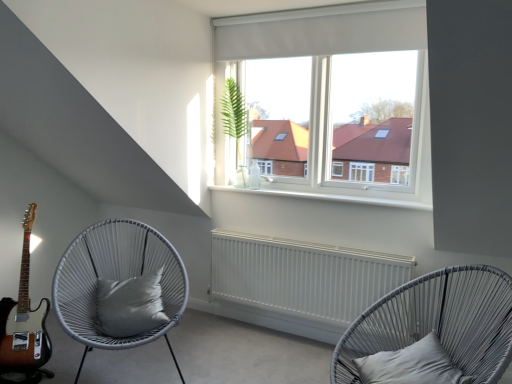
The image size is (512, 384). What do you see at coordinates (438, 322) in the screenshot? I see `matte grey wicker chair at lower right, which is the second chair in left-to-right order` at bounding box center [438, 322].

This screenshot has height=384, width=512. What do you see at coordinates (411, 365) in the screenshot?
I see `gray satin pillow at lower right, the second pillow from the back` at bounding box center [411, 365].

What do you see at coordinates (116, 279) in the screenshot?
I see `white woven chair with cushion at left, marked as the 2th chair in a right-to-left arrangement` at bounding box center [116, 279].

This screenshot has width=512, height=384. What are the coordinates of `silky gray pillow at center-left, arranged as the 2th pillow when viewed from the right` in the screenshot? It's located at (130, 305).

Measure the distance between sunburst wood guitar at lower left and camera.

The distance of sunburst wood guitar at lower left from camera is 7.86 feet.

Find the location of `white matte curtain at upper center`. white matte curtain at upper center is located at coordinates (323, 31).

Between gray satin pillow at lower right, placed as the second pillow when sorted from left to right, and silky gray pillow at center-left, which is the first pillow from left to right, which one is positioned behind?

silky gray pillow at center-left, which is the first pillow from left to right, is further away from the camera.

Consider the image. Is gray satin pillow at lower right, the first pillow viewed from the front, not inside silky gray pillow at center-left, positioned as the first pillow in back-to-front order?

Yes.

Who is bigger, gray satin pillow at lower right, placed as the second pillow when sorted from left to right, or silky gray pillow at center-left, positioned as the first pillow in back-to-front order?

Bigger between the two is silky gray pillow at center-left, positioned as the first pillow in back-to-front order.

Which of these two, gray satin pillow at lower right, which ranks as the first pillow in right-to-left order, or silky gray pillow at center-left, which is the first pillow from left to right, stands taller?

Standing taller between the two is silky gray pillow at center-left, which is the first pillow from left to right.

Is white matte curtain at upper center oriented towards silky gray pillow at center-left, arranged as the 2th pillow when viewed from the right?

No, white matte curtain at upper center does not turn towards silky gray pillow at center-left, arranged as the 2th pillow when viewed from the right.

Which object is further away from the camera taking this photo, white matte curtain at upper center or silky gray pillow at center-left, the 2th pillow positioned from the front?

Positioned behind is white matte curtain at upper center.

From a real-world perspective, is white matte curtain at upper center below silky gray pillow at center-left, positioned as the first pillow in back-to-front order?

No, from a real-world perspective, white matte curtain at upper center is not under silky gray pillow at center-left, positioned as the first pillow in back-to-front order.

How distant is white matte curtain at upper center from silky gray pillow at center-left, positioned as the first pillow in back-to-front order?

They are 1.81 meters apart.

Considering the sizes of objects silky gray pillow at center-left, the 2th pillow positioned from the front, and sunburst wood guitar at lower left in the image provided, who is smaller, silky gray pillow at center-left, the 2th pillow positioned from the front, or sunburst wood guitar at lower left?

With smaller size is silky gray pillow at center-left, the 2th pillow positioned from the front.

Image resolution: width=512 pixels, height=384 pixels. I want to click on guitar on the left of silky gray pillow at center-left, arranged as the 2th pillow when viewed from the right, so click(24, 324).

Between point (120, 314) and point (24, 252), which one is positioned in front?

The point (120, 314) is in front.

Is silky gray pillow at center-left, the 2th pillow positioned from the front, beside sunburst wood guitar at lower left?

They are not placed beside each other.

Considering the positions of objects white matte radiator at center and silky gray pillow at center-left, which is the first pillow from left to right, in the image provided, who is behind, white matte radiator at center or silky gray pillow at center-left, which is the first pillow from left to right,?

white matte radiator at center.

Looking at the image, does white matte radiator at center seem bigger or smaller compared to silky gray pillow at center-left, the 2th pillow positioned from the front?

In the image, white matte radiator at center appears to be larger than silky gray pillow at center-left, the 2th pillow positioned from the front.

Is white matte radiator at center far from silky gray pillow at center-left, positioned as the first pillow in back-to-front order?

white matte radiator at center is actually quite close to silky gray pillow at center-left, positioned as the first pillow in back-to-front order.

Is white matte radiator at center outside of silky gray pillow at center-left, positioned as the first pillow in back-to-front order?

Yes, white matte radiator at center is not within silky gray pillow at center-left, positioned as the first pillow in back-to-front order.

Consider the image. Looking at the image, does matte grey wicker chair at lower right, which is the second chair in left-to-right order, seem bigger or smaller compared to silky gray pillow at center-left, which is the first pillow from left to right?

matte grey wicker chair at lower right, which is the second chair in left-to-right order, is bigger than silky gray pillow at center-left, which is the first pillow from left to right.

From the image's perspective, between matte grey wicker chair at lower right, which is the second chair in left-to-right order, and silky gray pillow at center-left, the 2th pillow positioned from the front, which one is located above?

silky gray pillow at center-left, the 2th pillow positioned from the front, appears higher in the image.

Is matte grey wicker chair at lower right, which is the 1th chair in right-to-left order, not within silky gray pillow at center-left, arranged as the 2th pillow when viewed from the right?

Yes, matte grey wicker chair at lower right, which is the 1th chair in right-to-left order, is not within silky gray pillow at center-left, arranged as the 2th pillow when viewed from the right.

Is matte grey wicker chair at lower right, which is the second chair in left-to-right order, next to silky gray pillow at center-left, positioned as the first pillow in back-to-front order, and touching it?

matte grey wicker chair at lower right, which is the second chair in left-to-right order, and silky gray pillow at center-left, positioned as the first pillow in back-to-front order, are not in contact.

From a real-world perspective, is sunburst wood guitar at lower left on top of matte grey wicker chair at lower right, which is the 1th chair in right-to-left order?

A: Yes, from a real-world perspective, sunburst wood guitar at lower left is over matte grey wicker chair at lower right, which is the 1th chair in right-to-left order

Is sunburst wood guitar at lower left situated inside matte grey wicker chair at lower right, which is the 1th chair in right-to-left order, or outside?

sunburst wood guitar at lower left is located beyond the bounds of matte grey wicker chair at lower right, which is the 1th chair in right-to-left order.

Can you confirm if sunburst wood guitar at lower left is wider than matte grey wicker chair at lower right, which is the second chair in left-to-right order?

No, sunburst wood guitar at lower left is not wider than matte grey wicker chair at lower right, which is the second chair in left-to-right order.

Find the location of a particular element. radiator directly beneath the white woven chair with cushion at left, marked as the 2th chair in a right-to-left arrangement (from a real-world perspective) is located at coordinates (301, 281).

From the picture: Is white woven chair with cushion at left, marked as the 2th chair in a right-to-left arrangement, in contact with white matte radiator at center?

No, white woven chair with cushion at left, marked as the 2th chair in a right-to-left arrangement, is not with white matte radiator at center.

Consider the image. From a real-world perspective, which is physically below, white woven chair with cushion at left, the first chair when ordered from left to right, or white matte radiator at center?

white matte radiator at center.

Is white woven chair with cushion at left, marked as the 2th chair in a right-to-left arrangement, to the right of white matte radiator at center from the viewer's perspective?

No, white woven chair with cushion at left, marked as the 2th chair in a right-to-left arrangement, is not to the right of white matte radiator at center.

This screenshot has width=512, height=384. Identify the location of pillow behind the gray satin pillow at lower right, which ranks as the first pillow in right-to-left order. (130, 305).

Where is `pillow located on the left of white matte curtain at upper center`? pillow located on the left of white matte curtain at upper center is located at coordinates tap(130, 305).

Which object lies further to the anchor point sunburst wood guitar at lower left, matte grey wicker chair at lower right, which is the second chair in left-to-right order, or gray satin pillow at lower right, which ranks as the first pillow in right-to-left order?

matte grey wicker chair at lower right, which is the second chair in left-to-right order.

Which object lies further to the anchor point silky gray pillow at center-left, arranged as the 2th pillow when viewed from the right, white matte curtain at upper center or matte grey wicker chair at lower right, which is the second chair in left-to-right order?

white matte curtain at upper center is positioned further to the anchor silky gray pillow at center-left, arranged as the 2th pillow when viewed from the right.

From the image, which object appears to be farther from silky gray pillow at center-left, positioned as the first pillow in back-to-front order, green leafy plant at center or white matte radiator at center?

green leafy plant at center lies further to silky gray pillow at center-left, positioned as the first pillow in back-to-front order, than the other object.

Based on the photo, estimate the real-world distances between objects in this image. Which object is closer to white matte radiator at center, white matte curtain at upper center or silky gray pillow at center-left, positioned as the first pillow in back-to-front order?

silky gray pillow at center-left, positioned as the first pillow in back-to-front order.

Which object lies further to the anchor point green leafy plant at center, sunburst wood guitar at lower left or white matte curtain at upper center?

The object further to green leafy plant at center is sunburst wood guitar at lower left.

Based on the photo, when comparing their distances from sunburst wood guitar at lower left, does white matte radiator at center or green leafy plant at center seem further?

Based on the image, green leafy plant at center appears to be further to sunburst wood guitar at lower left.

Consider the image. Based on their spatial positions, is gray satin pillow at lower right, the second pillow from the back, or silky gray pillow at center-left, arranged as the 2th pillow when viewed from the right, further from sunburst wood guitar at lower left?

gray satin pillow at lower right, the second pillow from the back, lies further to sunburst wood guitar at lower left than the other object.

Based on their spatial positions, is white matte radiator at center or sunburst wood guitar at lower left closer to gray satin pillow at lower right, the second pillow from the back?

Based on the image, white matte radiator at center appears to be nearer to gray satin pillow at lower right, the second pillow from the back.

Where is `radiator positioned between matte grey wicker chair at lower right, which is the second chair in left-to-right order, and green leafy plant at center from near to far`? radiator positioned between matte grey wicker chair at lower right, which is the second chair in left-to-right order, and green leafy plant at center from near to far is located at coordinates (301, 281).

Identify the location of plant located between sunburst wood guitar at lower left and matte grey wicker chair at lower right, which is the 1th chair in right-to-left order, in the left-right direction. The width and height of the screenshot is (512, 384). (234, 115).

Identify the location of curtain between sunburst wood guitar at lower left and gray satin pillow at lower right, the first pillow viewed from the front. (323, 31).

Where is `radiator between sunburst wood guitar at lower left and matte grey wicker chair at lower right, which is the 1th chair in right-to-left order`? This screenshot has width=512, height=384. radiator between sunburst wood guitar at lower left and matte grey wicker chair at lower right, which is the 1th chair in right-to-left order is located at coordinates (301, 281).